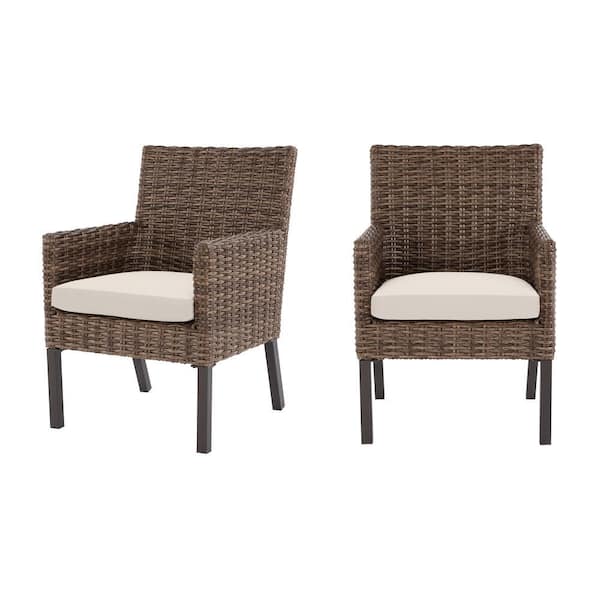
Locate an element on the screen. The height and width of the screenshot is (600, 600). top edge back of chair is located at coordinates pyautogui.click(x=216, y=146), pyautogui.click(x=457, y=147).